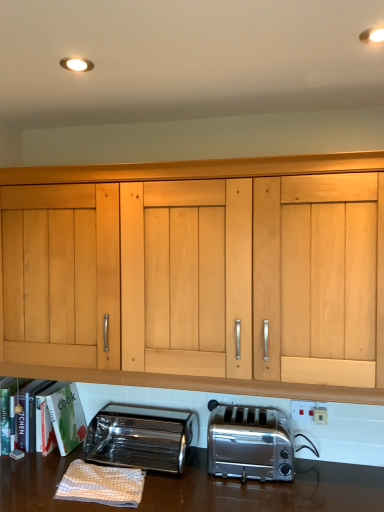
Question: Considering the positions of satin silver toaster at lower center, positioned as the first toaster in right-to-left order, and white checkered cloth at lower left in the image, is satin silver toaster at lower center, positioned as the first toaster in right-to-left order, bigger or smaller than white checkered cloth at lower left?

Choices:
 (A) small
 (B) big

Answer: (B)

Question: Considering the positions of satin silver toaster at lower center, positioned as the first toaster in right-to-left order, and white checkered cloth at lower left in the image, is satin silver toaster at lower center, positioned as the first toaster in right-to-left order, taller or shorter than white checkered cloth at lower left?

Choices:
 (A) tall
 (B) short

Answer: (A)

Question: Estimate the real-world distances between objects in this image. Which object is farther from the white checkered cloth at lower left?

Choices:
 (A) hardcover books at lower left
 (B) satin silver toaster at lower center, positioned as the first toaster in right-to-left order
 (C) white plastic electrical outlet at lower center, which is the second electric outlet in left-to-right order
 (D) white plastic electric outlet at center, placed as the second electric outlet when sorted from front to back
 (E) polished stainless steel toaster at lower left, arranged as the first toaster when viewed from the left

Answer: (C)

Question: Which is nearer to the hardcover books at lower left?

Choices:
 (A) white plastic electrical outlet at lower center, which is the second electric outlet in left-to-right order
 (B) white plastic electric outlet at center, placed as the second electric outlet when sorted from front to back
 (C) satin silver toaster at lower center, positioned as the first toaster in right-to-left order
 (D) polished stainless steel toaster at lower left, which is the 2th toaster from right to left
 (E) white checkered cloth at lower left

Answer: (D)